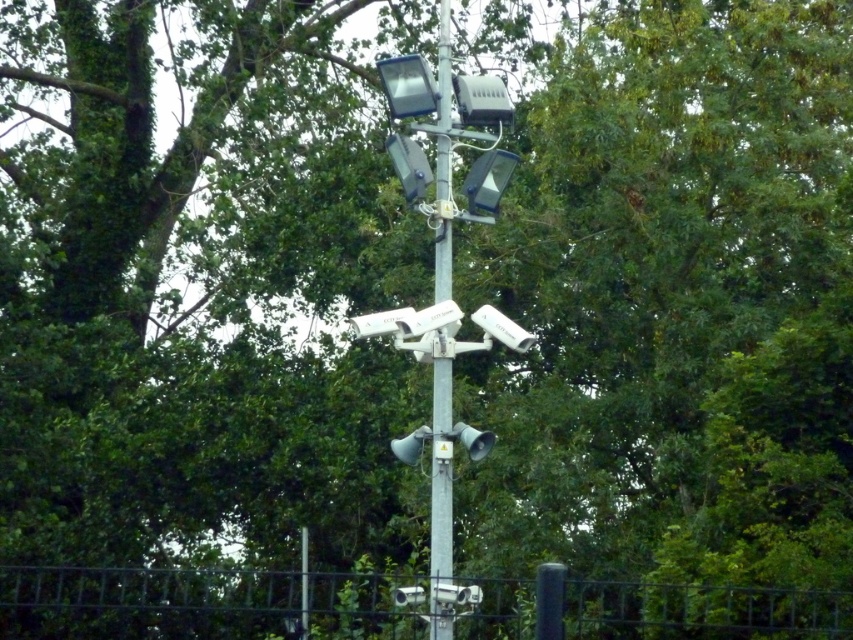
You are a maintenance worker needing to inspect the metallic gray pole at center. You notice the metallic wire mesh at lower center nearby. Which object is closer to you as you approach the pole?

The metallic wire mesh at lower center is closer to the viewer than the metallic gray pole at center, so the wire mesh would be closer as you approach the pole.

You are a maintenance worker needing to replace a part on the metallic gray pole at center. You have a ladder that is 10 meters long. Can you safely reach the metallic wire mesh at lower center with your ladder?

The distance between the metallic wire mesh at lower center and the metallic gray pole at center is 10.93 meters. Since your ladder is only 10 meters long, it is not long enough to safely reach the metallic wire mesh at lower center.